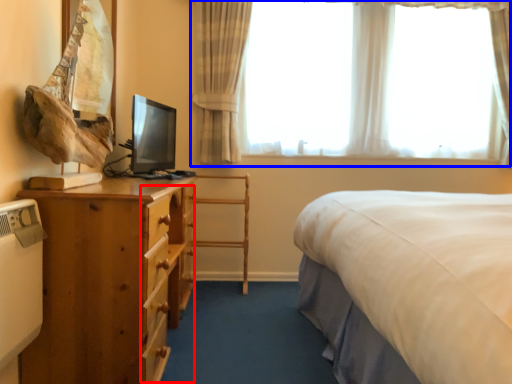
Question: Which of the following is the farthest to the observer, drawer (highlighted by a red box) or window (highlighted by a blue box)?

Choices:
 (A) drawer
 (B) window

Answer: (B)